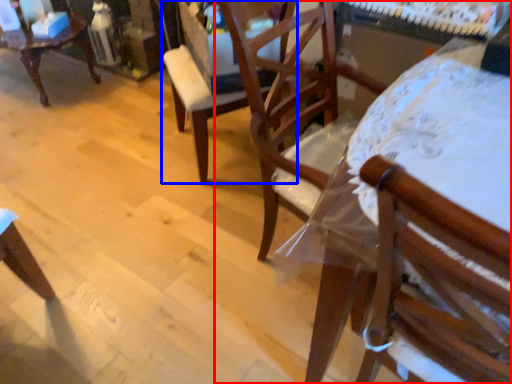
Question: Which object appears closest to the camera in this image, chair (highlighted by a red box) or chair (highlighted by a blue box)?

Choices:
 (A) chair
 (B) chair

Answer: (A)